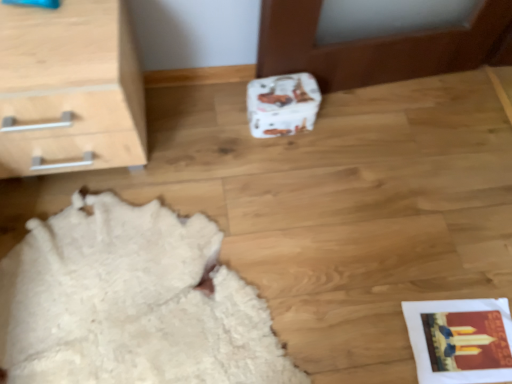
The width and height of the screenshot is (512, 384). I want to click on empty space that is ontop of white paper shoe box at center (from a real-world perspective), so [x=284, y=84].